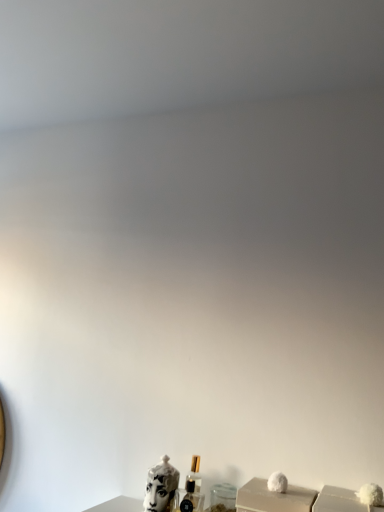
Question: Does clear glass perfume at center have a lesser height compared to white glossy sculpture at lower center?

Choices:
 (A) no
 (B) yes

Answer: (A)

Question: Considering the relative positions of clear glass perfume at center and white glossy sculpture at lower center in the image provided, is clear glass perfume at center to the left of white glossy sculpture at lower center from the viewer's perspective?

Choices:
 (A) yes
 (B) no

Answer: (B)

Question: From a real-world perspective, is clear glass perfume at center over white glossy sculpture at lower center?

Choices:
 (A) yes
 (B) no

Answer: (A)

Question: Is white glossy sculpture at lower center inside clear glass perfume at center?

Choices:
 (A) yes
 (B) no

Answer: (B)

Question: Considering the relative sizes of clear glass perfume at center and white glossy sculpture at lower center in the image provided, is clear glass perfume at center thinner than white glossy sculpture at lower center?

Choices:
 (A) yes
 (B) no

Answer: (A)

Question: In terms of height, does clear glass perfume at center look taller or shorter compared to white matte box at lower right?

Choices:
 (A) tall
 (B) short

Answer: (B)

Question: Would you say clear glass perfume at center is to the left or to the right of white matte box at lower right in the picture?

Choices:
 (A) right
 (B) left

Answer: (B)

Question: From the image's perspective, is clear glass perfume at center above or below white matte box at lower right?

Choices:
 (A) above
 (B) below

Answer: (B)

Question: Does point (190, 493) appear closer or farther from the camera than point (281, 497)?

Choices:
 (A) farther
 (B) closer

Answer: (A)

Question: Is white matte box at lower right situated inside clear glass perfume at center or outside?

Choices:
 (A) outside
 (B) inside

Answer: (A)

Question: In the image, is white matte box at lower right positioned in front of or behind clear glass perfume at center?

Choices:
 (A) behind
 (B) front

Answer: (B)

Question: Considering the positions of white matte box at lower right and clear glass perfume at center in the image, is white matte box at lower right taller or shorter than clear glass perfume at center?

Choices:
 (A) short
 (B) tall

Answer: (B)

Question: From a real-world perspective, is white matte box at lower right above or below clear glass perfume at center?

Choices:
 (A) below
 (B) above

Answer: (B)

Question: From the image's perspective, is white glossy sculpture at lower center located above or below clear glass perfume at center?

Choices:
 (A) above
 (B) below

Answer: (A)

Question: Would you say white glossy sculpture at lower center is inside or outside clear glass perfume at center?

Choices:
 (A) outside
 (B) inside

Answer: (A)